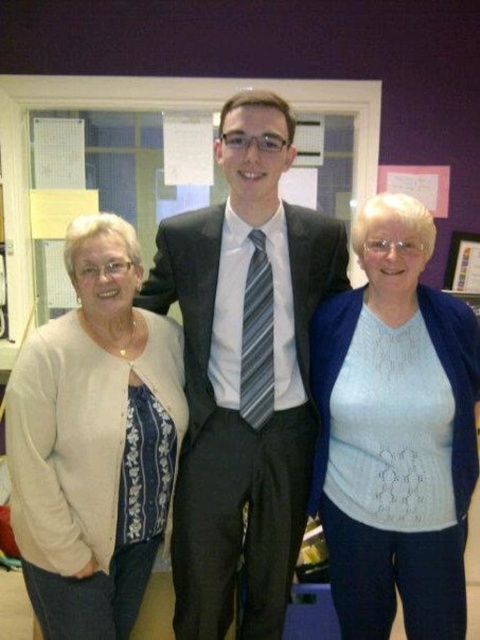
Can you confirm if matte black suit at center is shorter than white knit sweater at center?

No.

Which is more to the left, matte black suit at center or white knit sweater at center?

matte black suit at center is more to the left.

Locate an element on the screen. This screenshot has width=480, height=640. matte black suit at center is located at coordinates (243, 372).

Does matte black suit at center have a greater height compared to white knit cardigan at left?

Indeed, matte black suit at center has a greater height compared to white knit cardigan at left.

Who is higher up, matte black suit at center or white knit cardigan at left?

matte black suit at center

The height and width of the screenshot is (640, 480). Describe the element at coordinates (243, 372) in the screenshot. I see `matte black suit at center` at that location.

Locate an element on the screen. This screenshot has width=480, height=640. matte black suit at center is located at coordinates (243, 372).

Can you confirm if white knit sweater at center is thinner than white knit cardigan at left?

In fact, white knit sweater at center might be wider than white knit cardigan at left.

Is white knit sweater at center below white knit cardigan at left?

No.

Is point (388, 541) behind point (116, 256)?

Yes, it is behind point (116, 256).

You are a GUI agent. You are given a task and a screenshot of the screen. Output one action in this format:
    pyautogui.click(x=<x>, y=<y>)
    Task: Click on the white knit sweater at center
    The height and width of the screenshot is (640, 480).
    Given the screenshot: What is the action you would take?
    pyautogui.click(x=396, y=433)